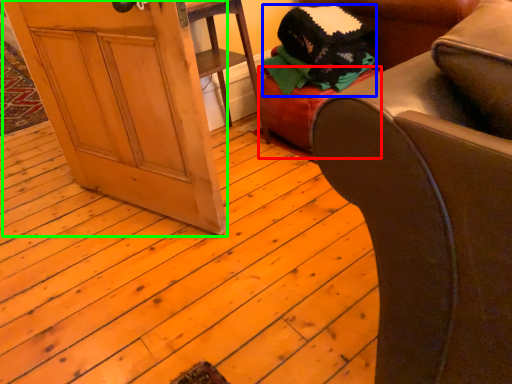
Question: Which object is the closest to the stool (highlighted by a red box)? Choose among these: clothing (highlighted by a blue box) or screen door (highlighted by a green box).

Choices:
 (A) clothing
 (B) screen door

Answer: (A)